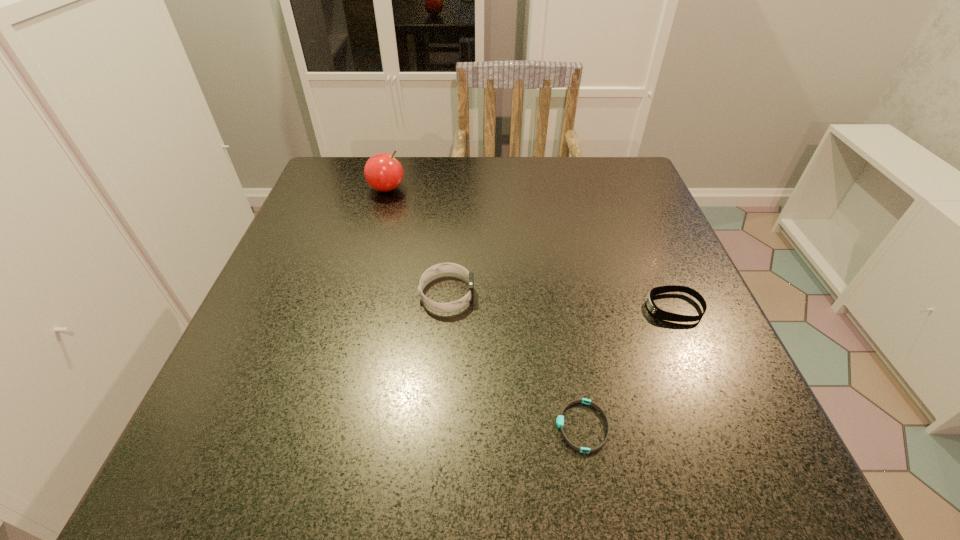
At what (x,y) coordinates should I click in order to perform the action: click on empty space between the nearest wristband and the rightmost object. Please return your answer as a coordinate pair (x, y). Image resolution: width=960 pixels, height=540 pixels. Looking at the image, I should click on (628, 367).

Identify the location of unoccupied area between the leftmost object and the second shortest object. (530, 248).

The height and width of the screenshot is (540, 960). I want to click on blank region between the rightmost object and the nearest object, so click(x=628, y=367).

Locate an element on the screen. blank region between the tallest wristband and the shortest object is located at coordinates (515, 360).

Image resolution: width=960 pixels, height=540 pixels. I want to click on free area in between the rightmost object and the nearest wristband, so click(628, 367).

The width and height of the screenshot is (960, 540). In order to click on free space between the second tallest wristband and the second object from left to right in this screenshot , I will do `click(561, 301)`.

Locate an element on the screen. The height and width of the screenshot is (540, 960). free space that is in between the second shortest object and the third object from right to left is located at coordinates (561, 301).

I want to click on object that stands as the third closest to the farthest object, so click(560, 419).

Point out which object is positioned as the nearest to the third shortest object. Please provide its 2D coordinates. Your answer should be formatted as a tuple, i.e. [(x, y)], where the tuple contains the x and y coordinates of a point satisfying the conditions above.

[(560, 419)]

Identify the location of wristband that stands as the closest to the leftmost object. (440, 268).